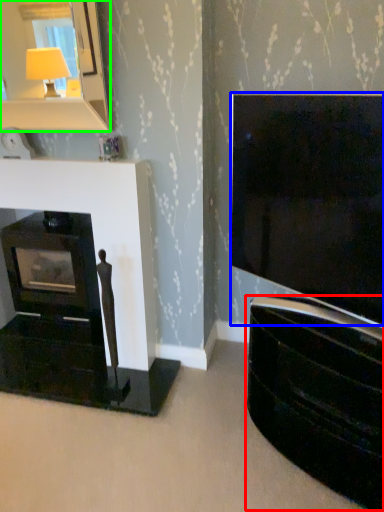
Question: Considering the real-world distances, which object is farthest from tv cabinet (highlighted by a red box)? television (highlighted by a blue box) or mirror (highlighted by a green box)?

Choices:
 (A) television
 (B) mirror

Answer: (B)